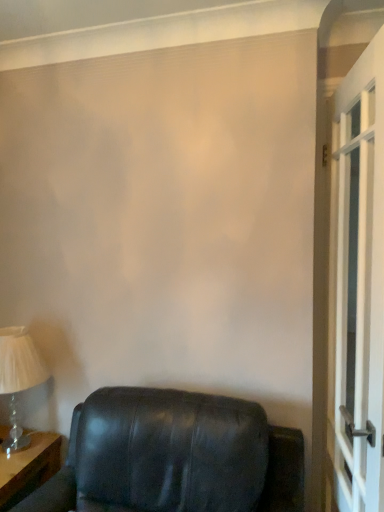
Describe the element at coordinates (18, 377) in the screenshot. The image size is (384, 512). I see `matte white lampshade at left` at that location.

In order to face white glass screen door at right, should I rotate leftwards or rightwards?

Rotate your view right by about 20.517°.

Locate an element on the screen. matte black leather chair at lower left is located at coordinates (174, 456).

How different are the orientations of matte white lampshade at left and wooden table at lower left in degrees?

matte white lampshade at left and wooden table at lower left are facing 2.94 degrees away from each other.

Locate an element on the screen. table lamp above the wooden table at lower left (from the image's perspective) is located at coordinates (18, 377).

Is matte white lampshade at left in front of or behind wooden table at lower left in the image?

In the image, matte white lampshade at left appears behind wooden table at lower left.

Is wooden table at lower left located within matte white lampshade at left?

Definitely not — wooden table at lower left is not inside matte white lampshade at left.

Is matte black leather chair at lower left wider than matte white lampshade at left?

Yes.

Looking at this image, considering the relative sizes of matte black leather chair at lower left and matte white lampshade at left in the image provided, is matte black leather chair at lower left shorter than matte white lampshade at left?

Incorrect, the height of matte black leather chair at lower left does not fall short of that of matte white lampshade at left.

Could you tell me if matte black leather chair at lower left is turned towards matte white lampshade at left?

No, matte black leather chair at lower left is not aimed at matte white lampshade at left.

Which object is more forward, matte black leather chair at lower left or matte white lampshade at left?

matte black leather chair at lower left is more forward.

Is wooden table at lower left taller than matte black leather chair at lower left?

No.

In the scene shown: Is wooden table at lower left far from matte black leather chair at lower left?

No, wooden table at lower left is in close proximity to matte black leather chair at lower left.

From a real-world perspective, relative to matte black leather chair at lower left, is wooden table at lower left vertically above or below?

wooden table at lower left is below matte black leather chair at lower left.

Which is in front, point (142, 475) or point (59, 456)?

The point (142, 475) is more forward.

Considering the sizes of objects matte black leather chair at lower left and wooden table at lower left in the image provided, who is smaller, matte black leather chair at lower left or wooden table at lower left?

wooden table at lower left is smaller.

From the image's perspective, between matte black leather chair at lower left and wooden table at lower left, who is located below?

wooden table at lower left appears lower in the image.

Would you say matte black leather chair at lower left is outside wooden table at lower left?

Yes, matte black leather chair at lower left is outside of wooden table at lower left.

Which of these two, white glass screen door at right or matte white lampshade at left, is wider?

Wider between the two is matte white lampshade at left.

From the image's perspective, relative to matte white lampshade at left, is white glass screen door at right above or below?

Based on their image positions, white glass screen door at right is located above matte white lampshade at left.

Visually, is white glass screen door at right positioned to the left or to the right of matte white lampshade at left?

In the image, white glass screen door at right appears on the right side of matte white lampshade at left.

Can you confirm if wooden table at lower left is thinner than white glass screen door at right?

Incorrect, the width of wooden table at lower left is not less than that of white glass screen door at right.

Is wooden table at lower left not within white glass screen door at right?

Indeed, wooden table at lower left is completely outside white glass screen door at right.

From the image's perspective, is wooden table at lower left above or below white glass screen door at right?

wooden table at lower left is situated lower than white glass screen door at right in the image.

From a real-world perspective, is matte white lampshade at left located higher than white glass screen door at right?

Actually, matte white lampshade at left is physically below white glass screen door at right in the real world.

Does matte white lampshade at left have a larger size compared to white glass screen door at right?

Incorrect, matte white lampshade at left is not larger than white glass screen door at right.

Is matte white lampshade at left in contact with white glass screen door at right?

They are not placed beside each other.

Could you tell me if matte white lampshade at left is turned towards white glass screen door at right?

No.

Find the location of `table located underneath the matte white lampshade at left (from a real-world perspective)`. table located underneath the matte white lampshade at left (from a real-world perspective) is located at coordinates (28, 468).

The width and height of the screenshot is (384, 512). Find the location of `table lamp above the matte black leather chair at lower left (from the image's perspective)`. table lamp above the matte black leather chair at lower left (from the image's perspective) is located at coordinates (18, 377).

Based on the photo, estimate the real-world distances between objects in this image. Which object is further from matte black leather chair at lower left, white glass screen door at right or wooden table at lower left?

Based on the image, white glass screen door at right appears to be further to matte black leather chair at lower left.

Considering their positions, is wooden table at lower left positioned further to white glass screen door at right than matte black leather chair at lower left?

wooden table at lower left lies further to white glass screen door at right than the other object.

When comparing their distances from white glass screen door at right, does matte white lampshade at left or wooden table at lower left seem further?

Based on the image, wooden table at lower left appears to be further to white glass screen door at right.

Considering their positions, is wooden table at lower left positioned closer to matte white lampshade at left than matte black leather chair at lower left?

Based on the image, wooden table at lower left appears to be nearer to matte white lampshade at left.

Which object lies further to the anchor point matte white lampshade at left, matte black leather chair at lower left or wooden table at lower left?

matte black leather chair at lower left lies further to matte white lampshade at left than the other object.

Which object lies nearer to the anchor point wooden table at lower left, matte white lampshade at left or matte black leather chair at lower left?

matte white lampshade at left is positioned closer to the anchor wooden table at lower left.

Considering their positions, is matte black leather chair at lower left positioned further to white glass screen door at right than wooden table at lower left?

The object further to white glass screen door at right is wooden table at lower left.

Which object lies nearer to the anchor point white glass screen door at right, wooden table at lower left or matte white lampshade at left?

Based on the image, matte white lampshade at left appears to be nearer to white glass screen door at right.

At what (x,y) coordinates should I click in order to perform the action: click on table lamp between wooden table at lower left and white glass screen door at right in the horizontal direction. Please return your answer as a coordinate pair (x, y). The width and height of the screenshot is (384, 512). Looking at the image, I should click on (18, 377).

The width and height of the screenshot is (384, 512). Find the location of `furniture between matte white lampshade at left and white glass screen door at right from left to right`. furniture between matte white lampshade at left and white glass screen door at right from left to right is located at coordinates (174, 456).

The height and width of the screenshot is (512, 384). Identify the location of table between matte black leather chair at lower left and matte white lampshade at left in the front-back direction. 28,468.

Image resolution: width=384 pixels, height=512 pixels. Identify the location of furniture between wooden table at lower left and white glass screen door at right from left to right. (174, 456).